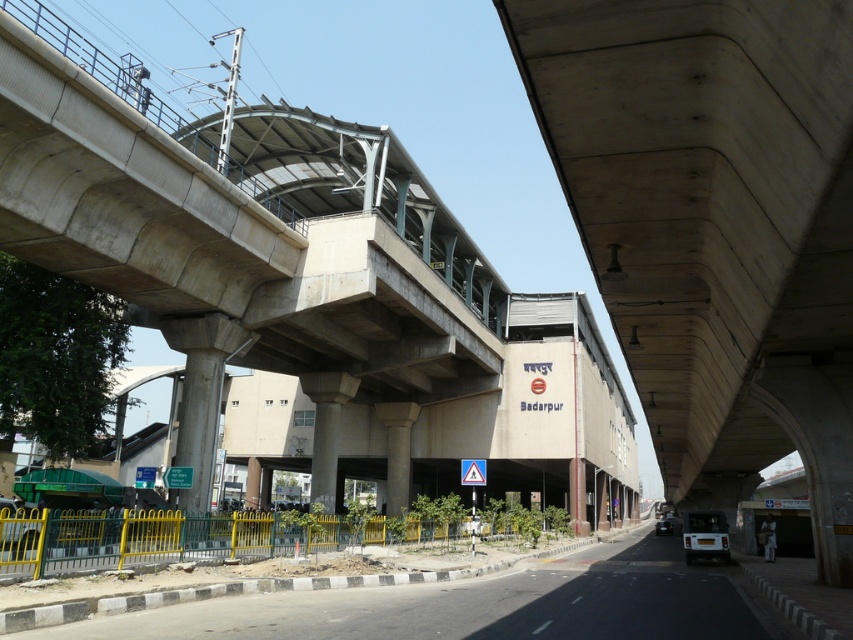
Which of these two, yellow metal fence at lower left or concrete column at center, stands shorter?

With less height is yellow metal fence at lower left.

Between yellow metal fence at lower left and concrete column at center, which one appears on the left side from the viewer's perspective?

Positioned to the left is concrete column at center.

Between point (651, 566) and point (390, 472), which one is positioned in front?

Point (651, 566)

I want to click on yellow metal fence at lower left, so click(x=479, y=605).

Who is lower down, white concrete pillar at center or concrete column at center?

concrete column at center is lower down.

Based on the photo, which is more to the left, white concrete pillar at center or concrete column at center?

From the viewer's perspective, white concrete pillar at center appears more on the left side.

Locate an element on the screen. white concrete pillar at center is located at coordinates (326, 429).

You are a GUI agent. You are given a task and a screenshot of the screen. Output one action in this format:
    pyautogui.click(x=<x>, y=<y>)
    Task: Click on the white concrete pillar at center
    Image resolution: width=853 pixels, height=640 pixels.
    Given the screenshot: What is the action you would take?
    pyautogui.click(x=326, y=429)

Is concrete bridge at center further to the viewer compared to white concrete pillar at center?

No.

Between concrete bridge at center and white concrete pillar at center, which one has less height?

With less height is white concrete pillar at center.

Identify the location of concrete bridge at center. (393, 308).